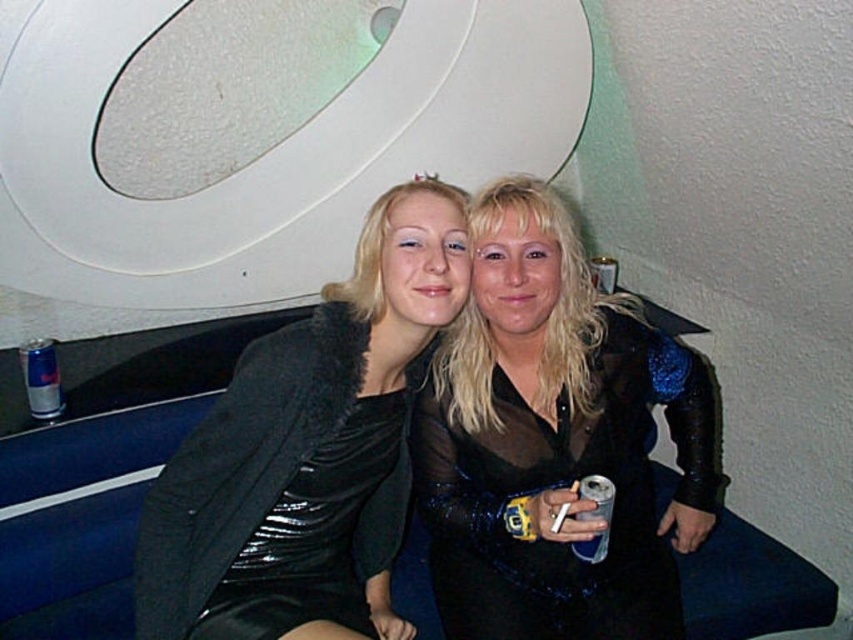
Which is more to the left, velvet black dress at center or black sequined dress at center?

velvet black dress at center

Where is `velvet black dress at center`? The height and width of the screenshot is (640, 853). velvet black dress at center is located at coordinates 308,451.

Does point (392, 486) lie behind point (505, 378)?

Yes, point (392, 486) is behind point (505, 378).

Find the location of a particular element. velvet black dress at center is located at coordinates (308, 451).